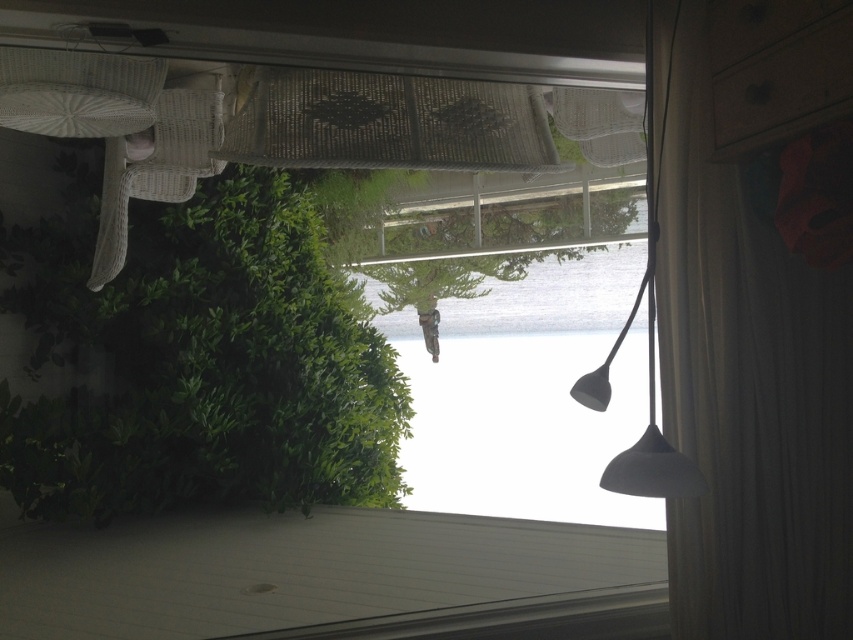
Between green leafy bush at left and white sheer curtain at lower right, which one appears on the right side from the viewer's perspective?

From the viewer's perspective, white sheer curtain at lower right appears more on the right side.

Does point (241, 422) lie in front of point (782, 29)?

No, (241, 422) is further to viewer.

Locate an element on the screen. This screenshot has width=853, height=640. green leafy bush at left is located at coordinates (201, 362).

Between green leafy bush at left and black matte lamp at center, which one has less height?

black matte lamp at center

Describe the element at coordinates (201, 362) in the screenshot. This screenshot has height=640, width=853. I see `green leafy bush at left` at that location.

Who is more forward, (259, 196) or (660, 129)?

Point (660, 129)

Find the location of a particular element. green leafy bush at left is located at coordinates (201, 362).

Can you confirm if transparent glass window at center is bigger than black matte lamp at center?

Yes, transparent glass window at center is bigger than black matte lamp at center.

Between transparent glass window at center and black matte lamp at center, which one appears on the left side from the viewer's perspective?

transparent glass window at center

Does point (508, 134) come behind point (579, 396)?

Yes, point (508, 134) is farther from viewer.

Identify the location of transparent glass window at center. This screenshot has width=853, height=640. (311, 310).